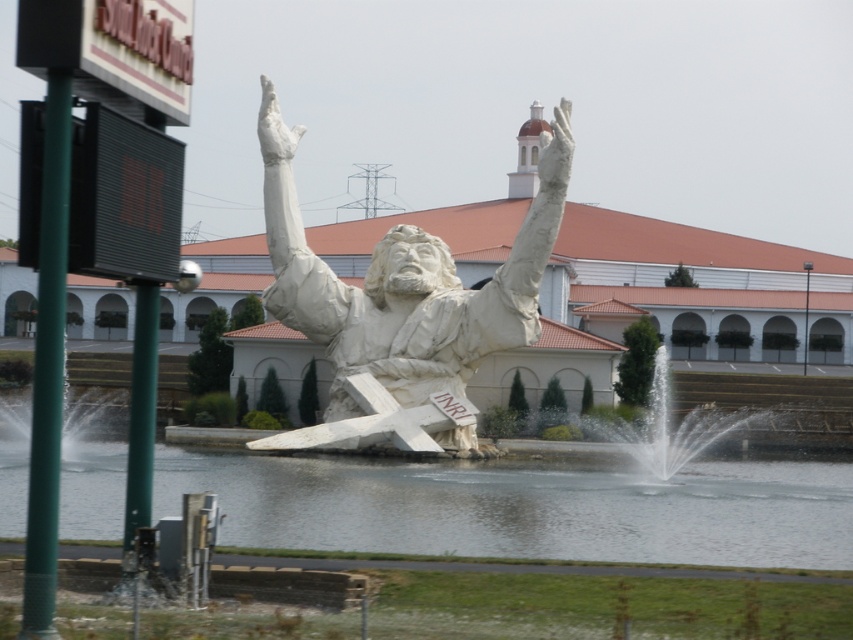
Can you confirm if clear water at center is smaller than white marble statue arm at center?

No.

Between clear water at center and white marble statue arm at center, which one is positioned lower?

clear water at center

In order to click on clear water at center in this screenshot , I will do tap(524, 508).

Does white marble statue at center have a smaller size compared to white marble statue arm at center?

Incorrect, white marble statue at center is not smaller in size than white marble statue arm at center.

Can you confirm if white marble statue at center is shorter than white marble statue arm at center?

In fact, white marble statue at center may be taller than white marble statue arm at center.

Where is `white marble statue at center`? white marble statue at center is located at coordinates pos(405,284).

Between point (833, 474) and point (643, 422), which one is positioned in front?

Point (833, 474) is in front.

Is clear water at center behind white stone fountain at center?

No.

Does point (442, 506) come closer to viewer compared to point (670, 412)?

Yes, it is in front of point (670, 412).

Identify the location of clear water at center. (524, 508).